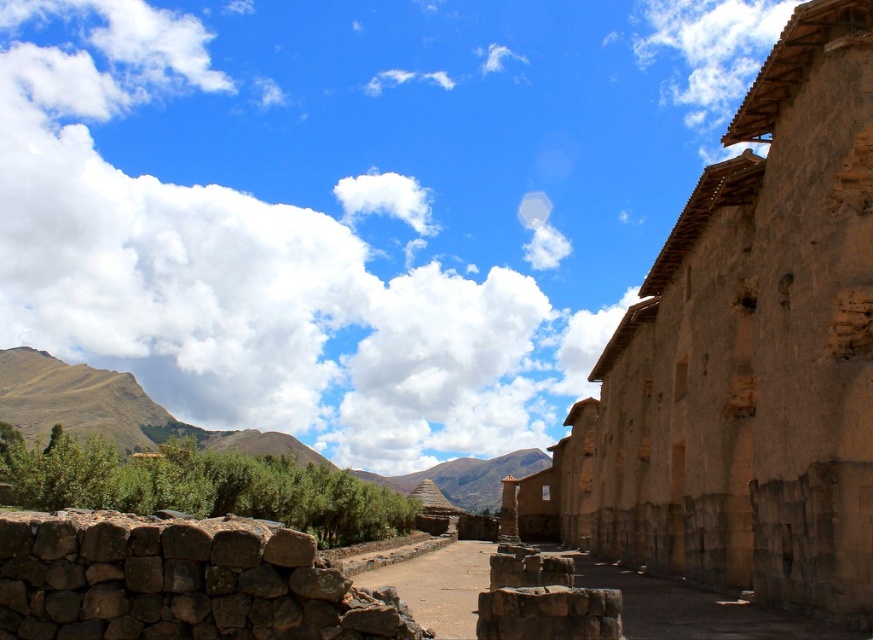
You are standing on the pathway and want to reach the brown mudbrick ruins at right. Which direction should you walk relative to the brown stone pillar at center?

You should walk to the right of the brown stone pillar at center to reach the brown mudbrick ruins at right since the brown mudbrick ruins at right is located to the right of the brown stone pillar at center.